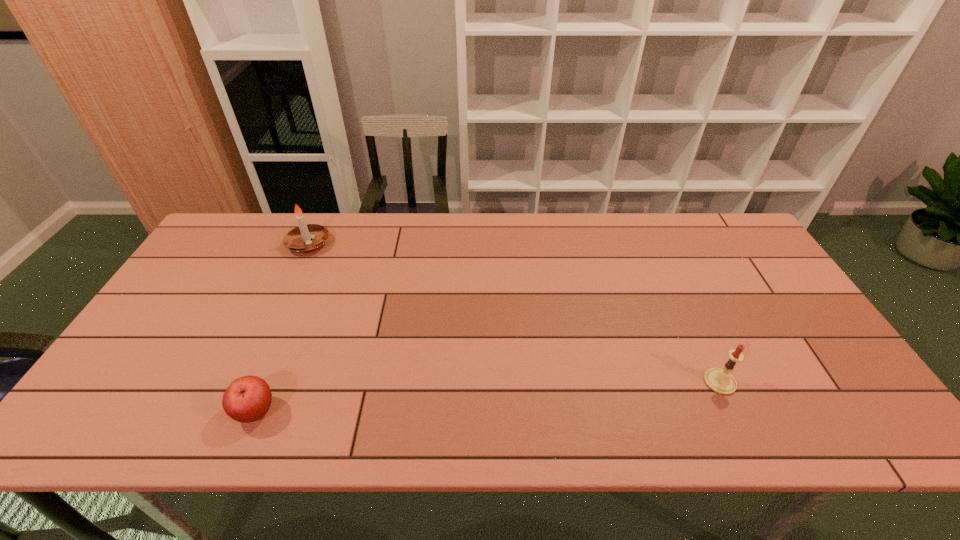
This screenshot has width=960, height=540. I want to click on vacant space that satisfies the following two spatial constraints: 1. on the back side of the apple; 2. on the left side of the rightmost object, so click(x=268, y=382).

This screenshot has width=960, height=540. Identify the location of free space that satisfies the following two spatial constraints: 1. on the front side of the shortest object; 2. on the right side of the left candle. (232, 411).